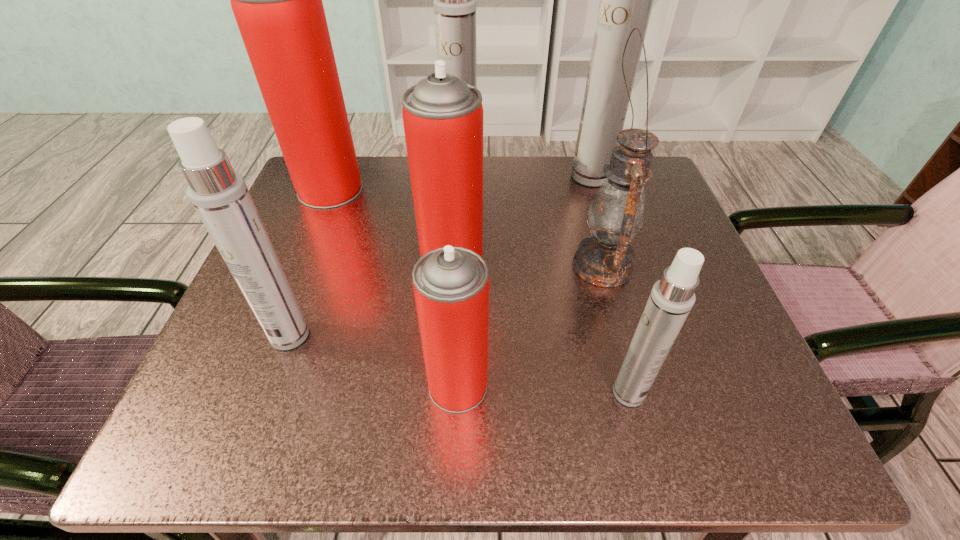
This screenshot has height=540, width=960. Find the location of `the tallest object`. the tallest object is located at coordinates (626, 0).

You are a GUI agent. You are given a task and a screenshot of the screen. Output one action in this format:
    pyautogui.click(x=<x>, y=<y>)
    Task: Click on the biggest white aerosol can
    The width and height of the screenshot is (960, 540).
    Given the screenshot: What is the action you would take?
    pyautogui.click(x=626, y=0)

This screenshot has height=540, width=960. Find the location of `the third smallest white aerosol can`. the third smallest white aerosol can is located at coordinates (454, 1).

Where is `the biggest red aerosol can`? the biggest red aerosol can is located at coordinates (277, 2).

The image size is (960, 540). Find the location of `the leftmost red aerosol can`. the leftmost red aerosol can is located at coordinates (277, 2).

Where is `oil lamp`? The width and height of the screenshot is (960, 540). oil lamp is located at coordinates (617, 212).

Locate an element on the screen. The height and width of the screenshot is (540, 960). the leftmost white aerosol can is located at coordinates (220, 196).

What are the coordinates of `the third biggest white aerosol can` in the screenshot? It's located at (220, 196).

Locate an element on the screen. The image size is (960, 540). the fourth farthest aerosol can is located at coordinates (442, 115).

The image size is (960, 540). Find the location of `the second smallest red aerosol can`. the second smallest red aerosol can is located at coordinates (442, 115).